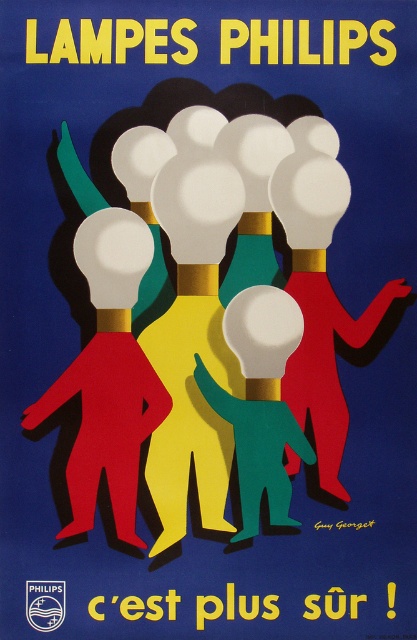
Question: Estimate the real-world distances between objects in this image. Which object is farther from the matte white bulb at center?

Choices:
 (A) matte red figure at center
 (B) green matte figure at center

Answer: (A)

Question: Which of the following is the farthest from the observer?

Choices:
 (A) [x=98, y=387]
 (B) [x=326, y=486]

Answer: (A)

Question: Which point is farther to the camera?

Choices:
 (A) (301, 419)
 (B) (135, 340)
 (C) (281, 408)

Answer: (B)

Question: Can you confirm if matte white bulb at center is bigger than matte red figure at center?

Choices:
 (A) yes
 (B) no

Answer: (A)

Question: Can you confirm if matte white bulb at center is positioned to the left of green matte figure at center?

Choices:
 (A) yes
 (B) no

Answer: (A)

Question: Is matte white bulb at center above green matte figure at center?

Choices:
 (A) yes
 (B) no

Answer: (A)